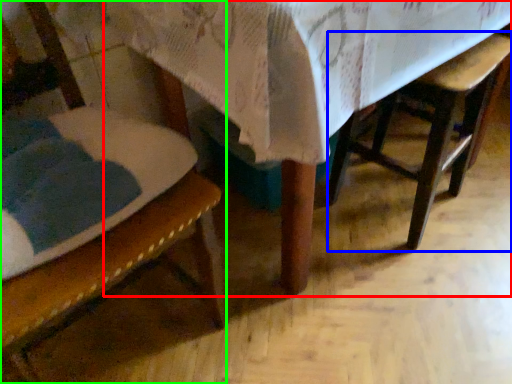
Question: Which object is the farthest from table (highlighted by a red box)? Choose among these: armchair (highlighted by a blue box) or chair (highlighted by a green box).

Choices:
 (A) armchair
 (B) chair

Answer: (A)